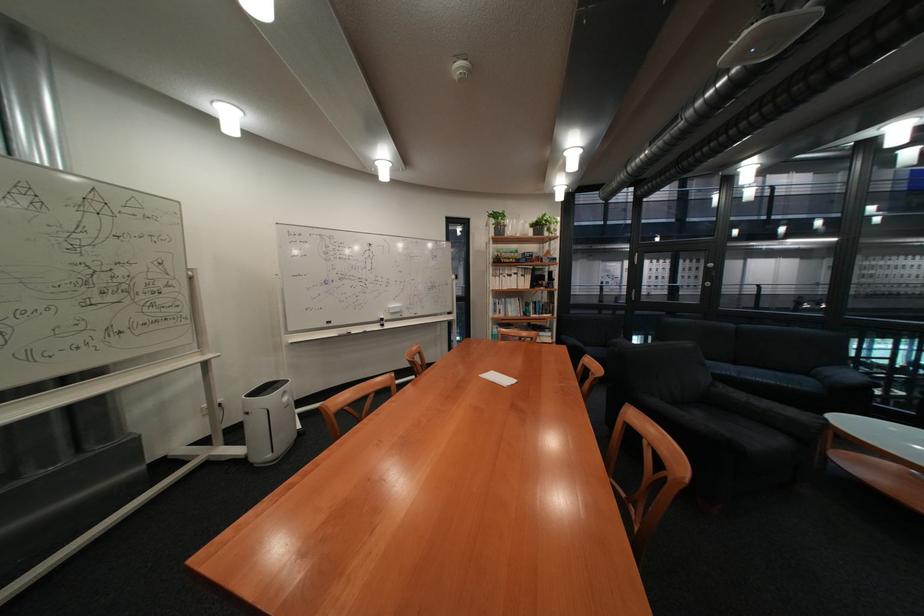
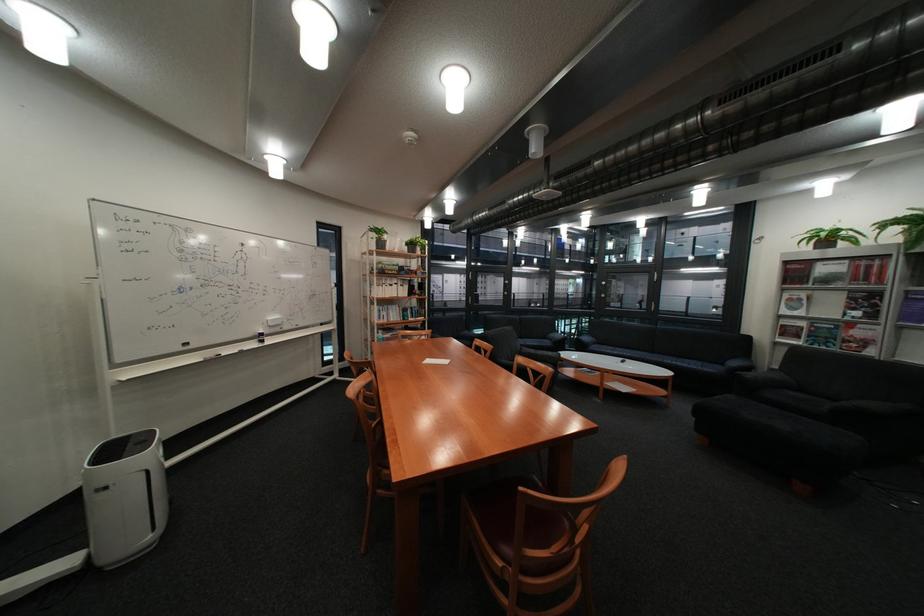
Where in the second image is the point corresponding to [548,225] from the first image?

(421, 245)